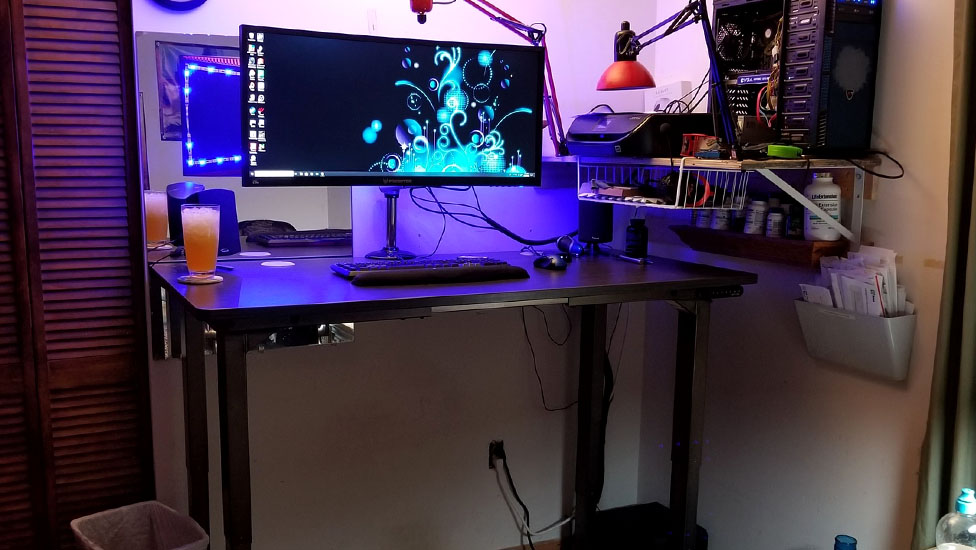
You are a GUI agent. You are given a task and a screenshot of the screen. Output one action in this format:
    pyautogui.click(x=<x>, y=<y>)
    Task: Click on the power outlet
    This screenshot has width=976, height=550.
    Given the screenshot: What is the action you would take?
    coord(497,451)